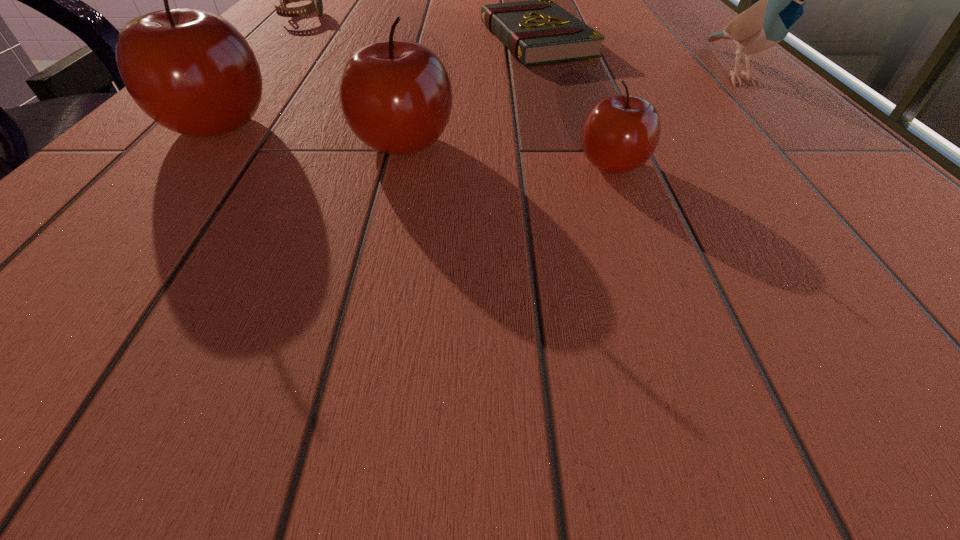
Find the location of a particular element. This screenshot has width=960, height=540. the leftmost apple is located at coordinates (190, 70).

The height and width of the screenshot is (540, 960). In order to click on the third object from left to right in this screenshot , I will do `click(396, 96)`.

Image resolution: width=960 pixels, height=540 pixels. I want to click on the second apple from right to left, so click(396, 96).

Locate an element on the screen. The image size is (960, 540). the fourth tallest object is located at coordinates (620, 133).

You are a GUI agent. You are given a task and a screenshot of the screen. Output one action in this format:
    pyautogui.click(x=<x>, y=<y>)
    Task: Click on the rightmost apple
    The image size is (960, 540).
    Given the screenshot: What is the action you would take?
    pyautogui.click(x=620, y=133)

Locate an element on the screen. Image resolution: width=960 pixels, height=540 pixels. the fifth tallest object is located at coordinates (316, 6).

The width and height of the screenshot is (960, 540). Find the location of `bird`. bird is located at coordinates (781, 3).

Find the location of a particular element. The height and width of the screenshot is (540, 960). the shortest object is located at coordinates (536, 32).

Locate an element on the screen. free space located 0.090m on the front of the leftmost apple is located at coordinates (155, 198).

Locate an element on the screen. Image resolution: width=960 pixels, height=540 pixels. free space located 0.090m on the right of the third tallest object is located at coordinates (524, 144).